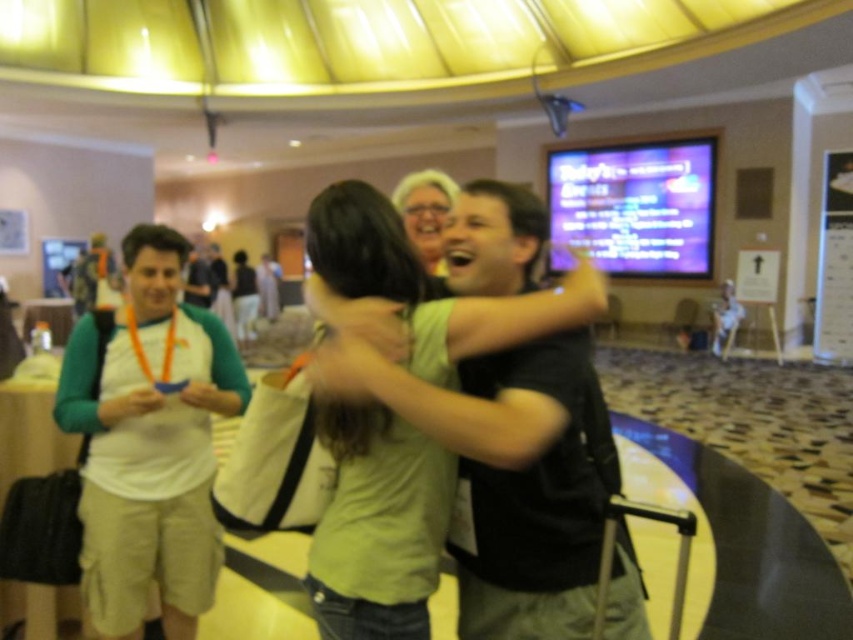
Question: Is green matte shirt at center above white fabric shirt at left?

Choices:
 (A) yes
 (B) no

Answer: (A)

Question: Which object appears farthest from the camera in this image?

Choices:
 (A) white fabric shirt at left
 (B) green matte shirt at center

Answer: (A)

Question: Can you confirm if green matte shirt at center is positioned above white fabric shirt at left?

Choices:
 (A) no
 (B) yes

Answer: (B)

Question: Is green matte shirt at center wider than white fabric shirt at left?

Choices:
 (A) no
 (B) yes

Answer: (A)